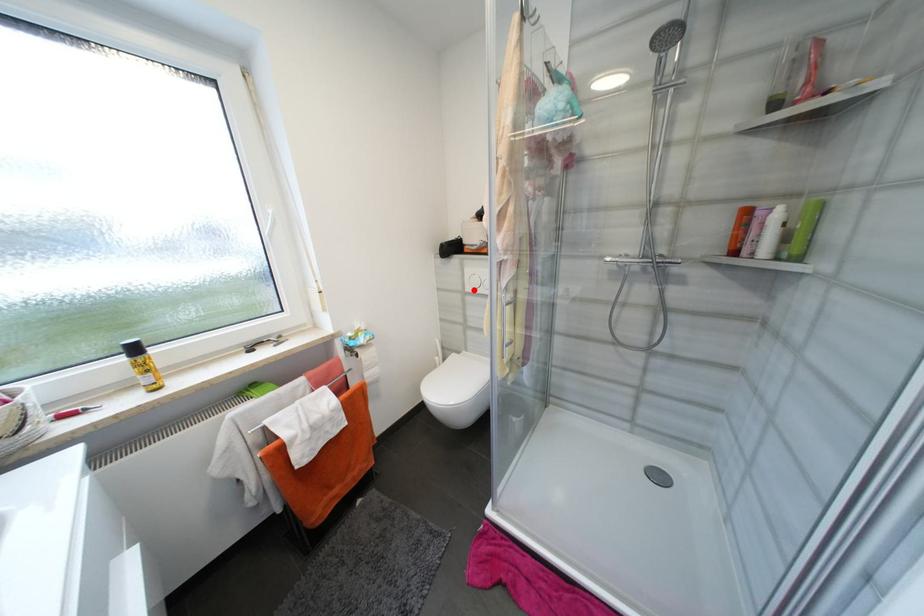
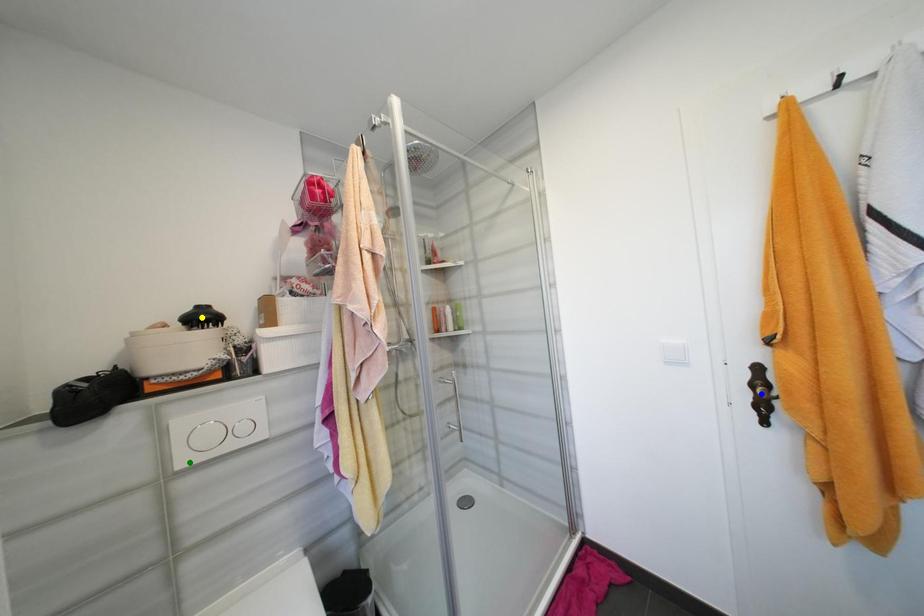
Question: I am providing you with two images of the same scene from different viewpoints. A red point is marked on the first image. You are given multiple points on the second image. Which mark in image 2 goes with the point in image 1?

Choices:
 (A) yellow point
 (B) green point
 (C) blue point

Answer: (B)